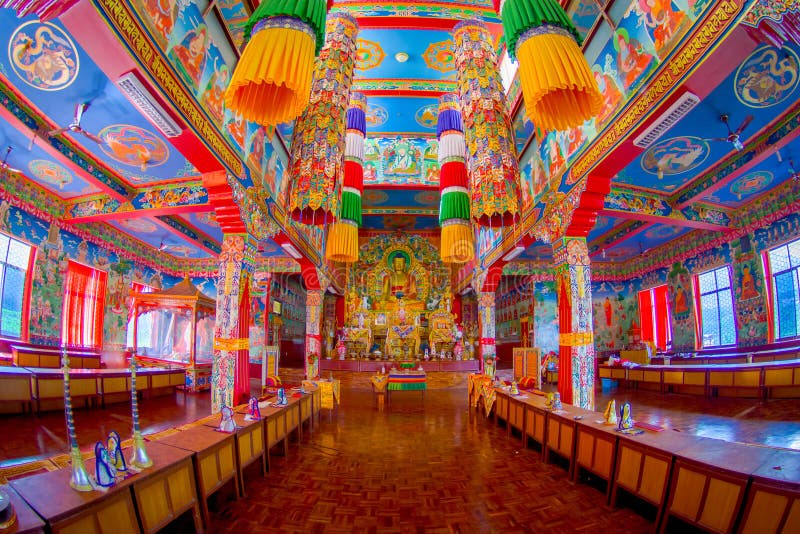
Locate an element on the screen. This screenshot has width=800, height=534. tables is located at coordinates (85, 367), (196, 439), (657, 436), (682, 363), (702, 348).